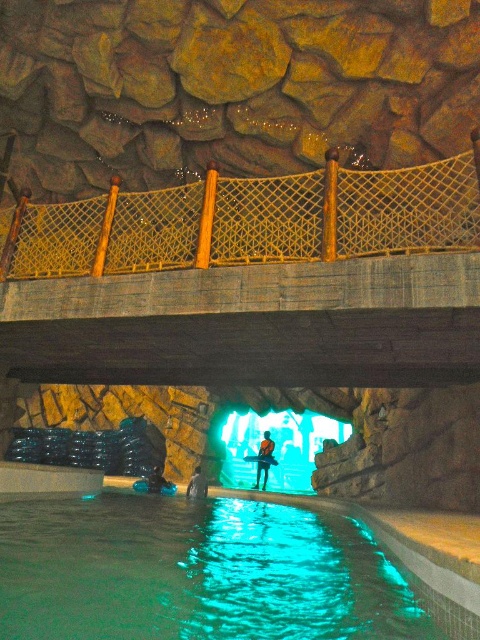
Question: Is clear plastic pool at lower center positioned behind orange life vest at center?

Choices:
 (A) no
 (B) yes

Answer: (A)

Question: Which object is closer to the camera taking this photo?

Choices:
 (A) translucent glass cave at center
 (B) orange life vest at center
 (C) yellow mesh rope bridge at upper center
 (D) clear plastic pool at lower center

Answer: (D)

Question: Does yellow mesh rope bridge at upper center come in front of clear plastic pool at lower center?

Choices:
 (A) yes
 (B) no

Answer: (B)

Question: Which object is the farthest from the yellow mesh rope bridge at upper center?

Choices:
 (A) blue rubber boots at lower center
 (B) blue fabric person at lower center
 (C) clear plastic pool at lower center

Answer: (B)

Question: In this image, where is clear plastic pool at lower center located relative to orange life vest at center?

Choices:
 (A) right
 (B) left

Answer: (B)

Question: Which of the following is the farthest from the observer?

Choices:
 (A) blue rubber boots at lower center
 (B) clear plastic pool at lower center
 (C) yellow mesh rope bridge at upper center
 (D) orange life vest at center

Answer: (D)